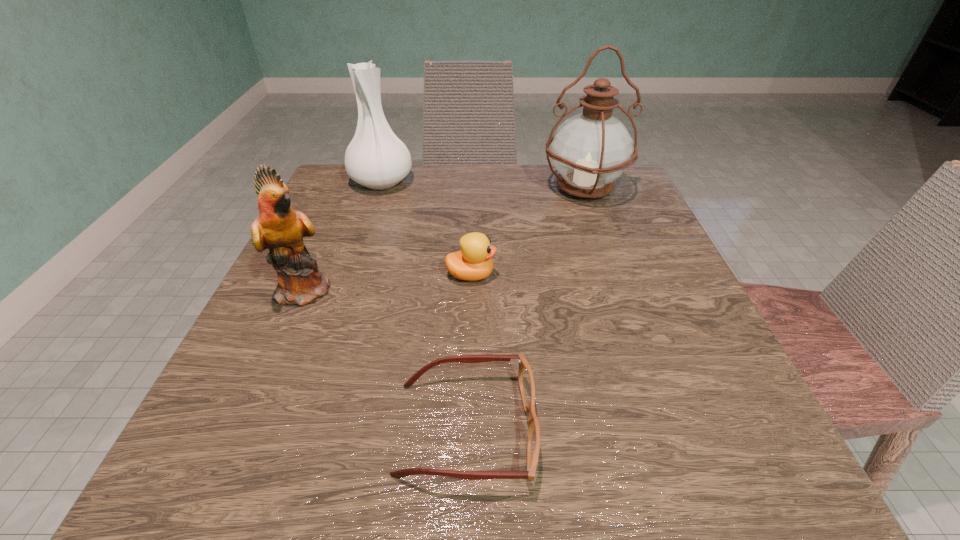
I want to click on the tallest object, so click(x=590, y=150).

This screenshot has width=960, height=540. I want to click on the rightmost object, so tap(590, 150).

At what (x,y) coordinates should I click in order to perform the action: click on vase. Please return your answer as a coordinate pair (x, y). Image resolution: width=960 pixels, height=540 pixels. Looking at the image, I should click on (376, 158).

I want to click on parrot, so point(279,228).

You are a GUI agent. You are given a task and a screenshot of the screen. Output one action in this format:
    pyautogui.click(x=<x>, y=<y>)
    Task: Click on the duckling
    Image resolution: width=960 pixels, height=540 pixels.
    Given the screenshot: What is the action you would take?
    pyautogui.click(x=474, y=262)

Where is `spectacles`? spectacles is located at coordinates (526, 383).

Where is `the nearest object`? The image size is (960, 540). the nearest object is located at coordinates (526, 383).

Where is `blank space located on the front of the rightmost object`? The image size is (960, 540). blank space located on the front of the rightmost object is located at coordinates (618, 285).

Where is `free space located 0.360m on the right of the vase`? This screenshot has width=960, height=540. free space located 0.360m on the right of the vase is located at coordinates (563, 181).

Locate an element on the screen. free region located 0.090m on the front-facing side of the parrot is located at coordinates (385, 288).